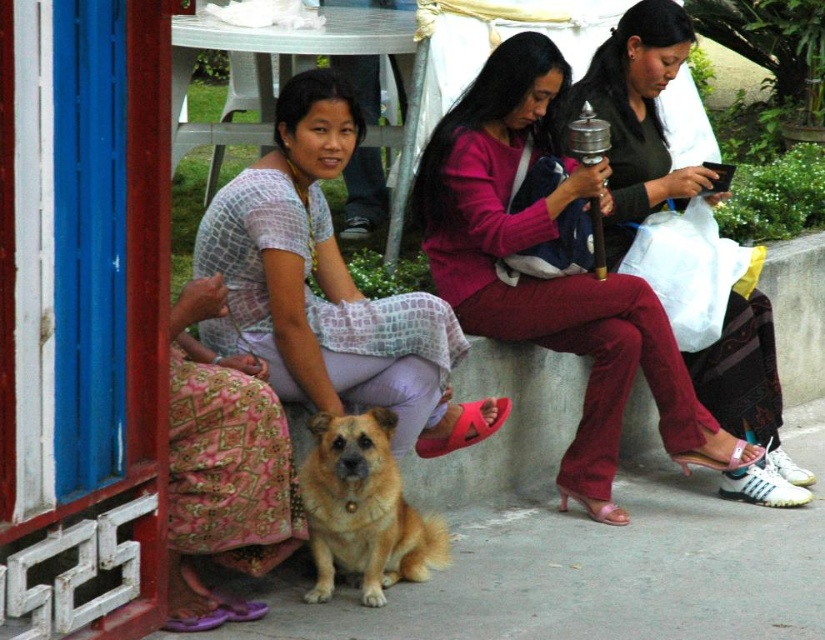
Question: Is matte white dress at center thinner than golden fur dog at center?

Choices:
 (A) yes
 (B) no

Answer: (B)

Question: Does matte pink sweater at center come behind golden fur dog at center?

Choices:
 (A) no
 (B) yes

Answer: (B)

Question: Estimate the real-world distances between objects in this image. Which object is closer to the golden fur dog at center?

Choices:
 (A) matte pink sweater at center
 (B) matte white dress at center

Answer: (B)

Question: Which point is closer to the camera?

Choices:
 (A) matte pink sweater at center
 (B) golden fur dog at center
 (C) matte white dress at center

Answer: (B)

Question: Which object is the farthest from the golden fur dog at center?

Choices:
 (A) matte white dress at center
 (B) matte pink sweater at center

Answer: (B)

Question: Does matte pink sweater at center have a smaller size compared to golden fur dog at center?

Choices:
 (A) no
 (B) yes

Answer: (A)